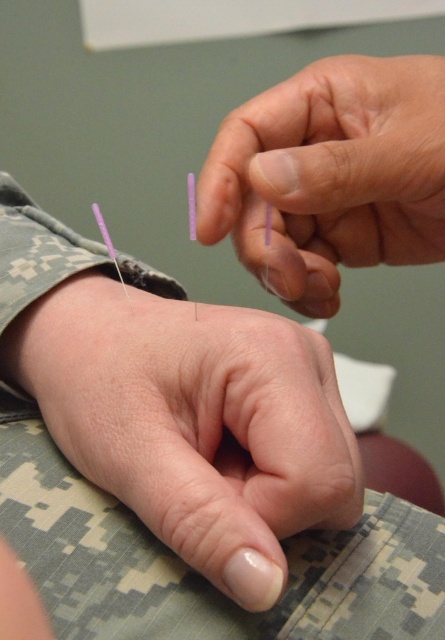
Question: Does transparent plastic needles at upper center come in front of purple matte needle at wrist?

Choices:
 (A) no
 (B) yes

Answer: (B)

Question: Which of these objects is positioned closest to the smooth skin at center?

Choices:
 (A) transparent plastic needles at upper center
 (B) purple matte needle at wrist

Answer: (B)

Question: Can you confirm if smooth skin at center is positioned below purple matte needle at wrist?

Choices:
 (A) yes
 (B) no

Answer: (A)

Question: Is transparent plastic needles at upper center to the left of purple matte needle at wrist from the viewer's perspective?

Choices:
 (A) yes
 (B) no

Answer: (B)

Question: Based on their relative distances, which object is nearer to the smooth skin at center?

Choices:
 (A) purple matte needle at wrist
 (B) transparent plastic needles at upper center

Answer: (A)

Question: Which point appears closest to the camera in this image?

Choices:
 (A) (153, 404)
 (B) (126, 289)
 (C) (271, 106)

Answer: (A)